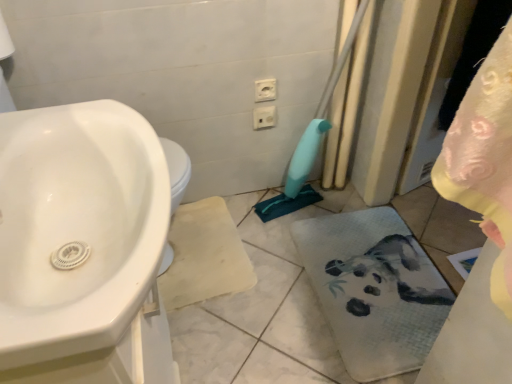
Question: Considering the positions of white plastic electric outlet at upper center, the first electric outlet viewed from the front, and white plastic electric outlet at upper center, positioned as the 1th electric outlet in back-to-front order, in the image, is white plastic electric outlet at upper center, the first electric outlet viewed from the front, bigger or smaller than white plastic electric outlet at upper center, positioned as the 1th electric outlet in back-to-front order,?

Choices:
 (A) big
 (B) small

Answer: (B)

Question: Considering the positions of white plastic electric outlet at upper center, which appears as the 1th electric outlet when viewed from the top, and white plastic electric outlet at upper center, which is the 1th electric outlet from bottom to top, in the image, is white plastic electric outlet at upper center, which appears as the 1th electric outlet when viewed from the top, wider or thinner than white plastic electric outlet at upper center, which is the 1th electric outlet from bottom to top,?

Choices:
 (A) thin
 (B) wide

Answer: (A)

Question: Which of these objects is positioned closest to the white plastic electric outlet at upper center, the first electric outlet viewed from the front?

Choices:
 (A) white plastic electric outlet at upper center, the second electric outlet positioned from the top
 (B) white fabric bath towel at lower right
 (C) white glossy sink at left

Answer: (A)

Question: Estimate the real-world distances between objects in this image. Which object is farther from the white glossy sink at left?

Choices:
 (A) white plastic electric outlet at upper center, which is the 1th electric outlet from bottom to top
 (B) white plastic electric outlet at upper center, the 2th electric outlet from the bottom
 (C) white fabric bath towel at lower right

Answer: (A)